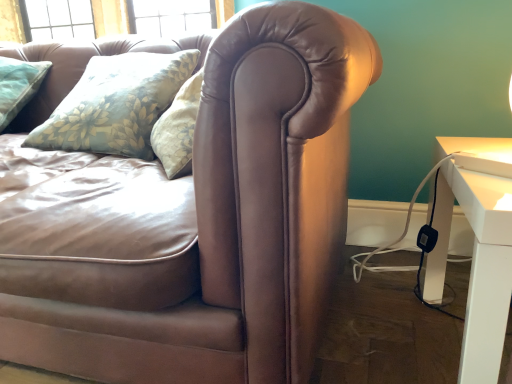
Question: Do you think white glossy table at right is within brown leather couch at center, or outside of it?

Choices:
 (A) inside
 (B) outside

Answer: (B)

Question: Considering the positions of white glossy table at right and brown leather couch at center in the image, is white glossy table at right bigger or smaller than brown leather couch at center?

Choices:
 (A) small
 (B) big

Answer: (A)

Question: From the image's perspective, is white glossy table at right above or below brown leather couch at center?

Choices:
 (A) above
 (B) below

Answer: (B)

Question: In the image, is brown leather couch at center positioned in front of or behind white glossy table at right?

Choices:
 (A) behind
 (B) front

Answer: (B)

Question: From a real-world perspective, relative to white glossy table at right, is brown leather couch at center vertically above or below?

Choices:
 (A) above
 (B) below

Answer: (A)

Question: Is brown leather couch at center bigger or smaller than white glossy table at right?

Choices:
 (A) small
 (B) big

Answer: (B)

Question: Is brown leather couch at center inside or outside of white glossy table at right?

Choices:
 (A) outside
 (B) inside

Answer: (A)